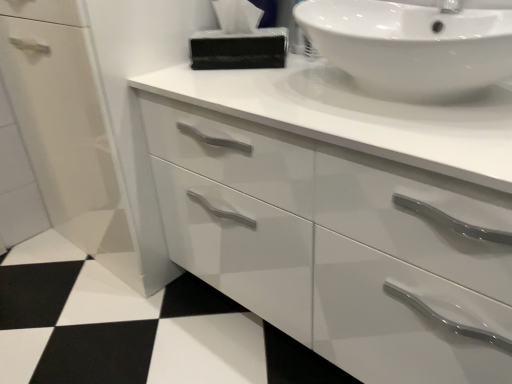
Locate an element on the screen. The width and height of the screenshot is (512, 384). vacant area that lies between white glossy sink at upper right and black glossy tissue at upper center is located at coordinates (263, 67).